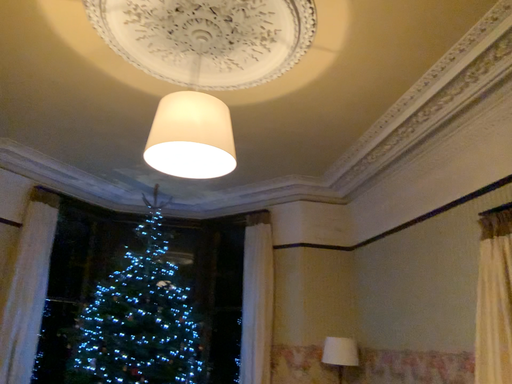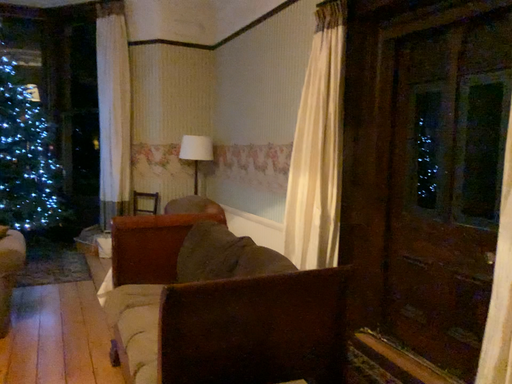
Question: How did the camera likely rotate when shooting the video?

Choices:
 (A) rotated right
 (B) rotated left

Answer: (A)